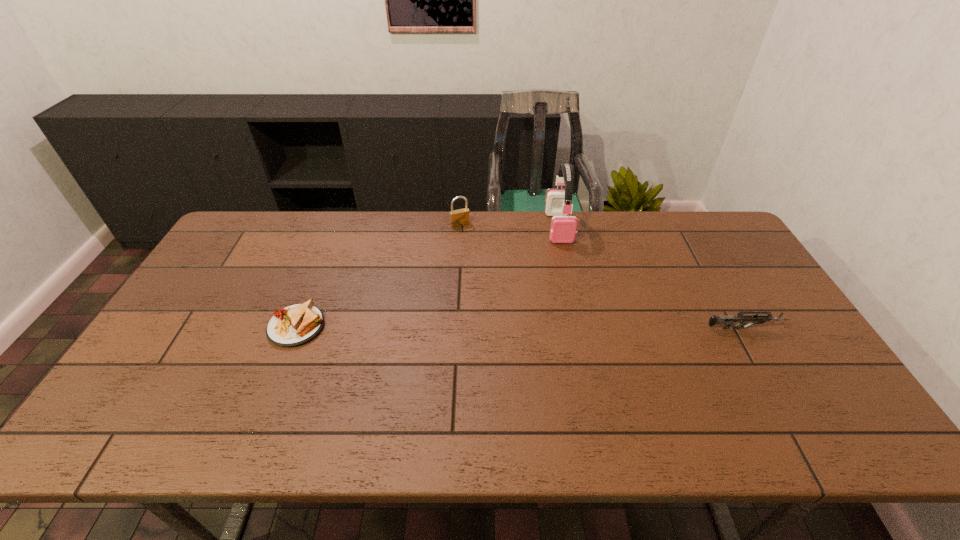
In order to click on the leftmost object in this screenshot , I will do `click(295, 325)`.

Where is `sandwich`? The width and height of the screenshot is (960, 540). sandwich is located at coordinates (295, 325).

In order to click on gun in this screenshot , I will do `click(727, 321)`.

Locate an element on the screen. This screenshot has width=960, height=540. the rightmost object is located at coordinates (727, 321).

Image resolution: width=960 pixels, height=540 pixels. I want to click on the second tallest object, so click(x=460, y=217).

Where is `the third object from right to left`? the third object from right to left is located at coordinates (460, 217).

Locate an element on the screen. This screenshot has height=540, width=960. the third object from left to right is located at coordinates (563, 228).

Identify the location of earphone. (563, 228).

Find the location of a particular element. vacant area situated on the right of the sandwich is located at coordinates (379, 327).

Image resolution: width=960 pixels, height=540 pixels. I want to click on vacant space located 0.380m on the front-facing side of the third object from right to left, so click(x=504, y=301).